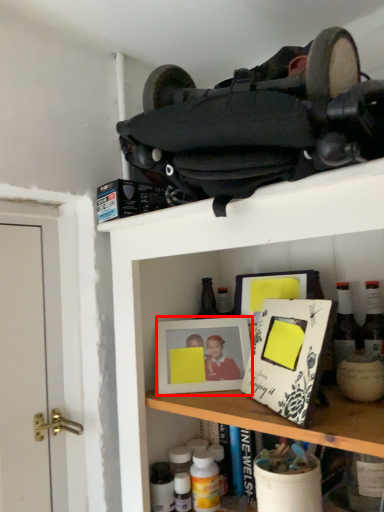
Question: Considering the relative positions of picture frame (annotated by the red box) and bottle in the image provided, where is picture frame (annotated by the red box) located with respect to the staircase?

Choices:
 (A) right
 (B) left

Answer: (B)